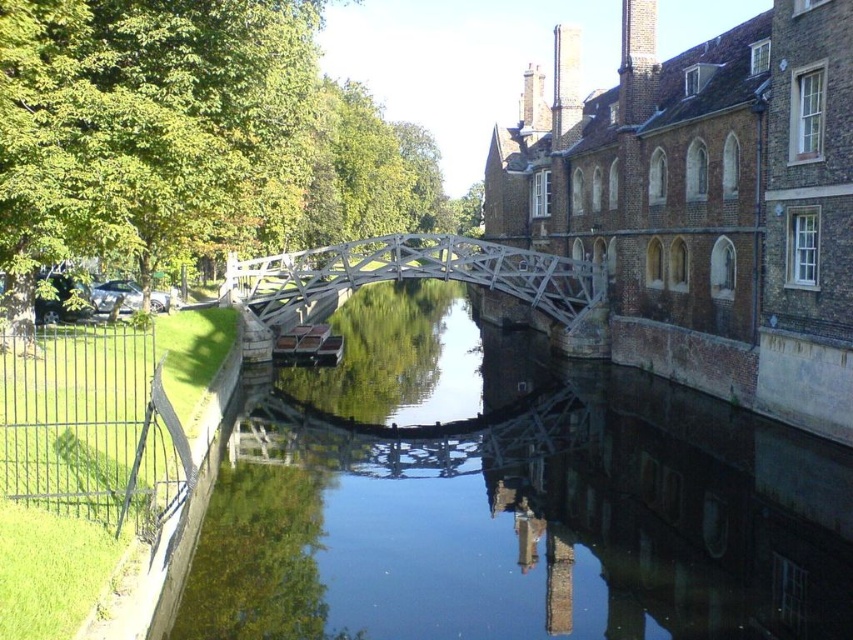
Question: Does clear water at center have a greater width compared to white wooden bridge at center?

Choices:
 (A) no
 (B) yes

Answer: (B)

Question: In this image, where is clear water at center located relative to white wooden bridge at center?

Choices:
 (A) left
 (B) right

Answer: (B)

Question: Is clear water at center further to the viewer compared to white wooden bridge at center?

Choices:
 (A) no
 (B) yes

Answer: (A)

Question: Which object appears farthest from the camera in this image?

Choices:
 (A) clear water at center
 (B) white wooden bridge at center

Answer: (B)

Question: Which point is farther to the camera?

Choices:
 (A) clear water at center
 (B) white wooden bridge at center

Answer: (B)